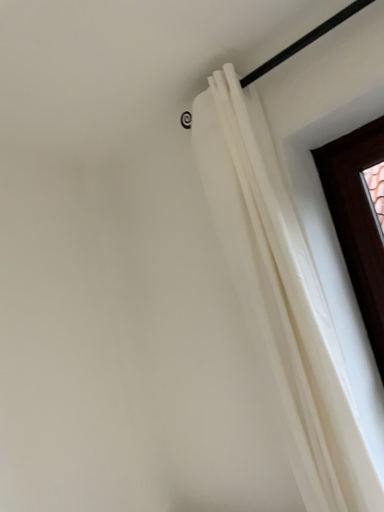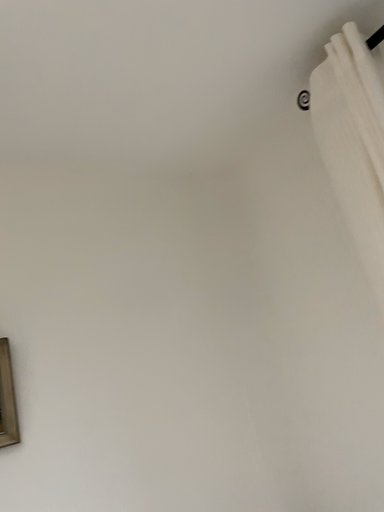
Question: Which way did the camera rotate in the video?

Choices:
 (A) rotated right
 (B) rotated left

Answer: (B)